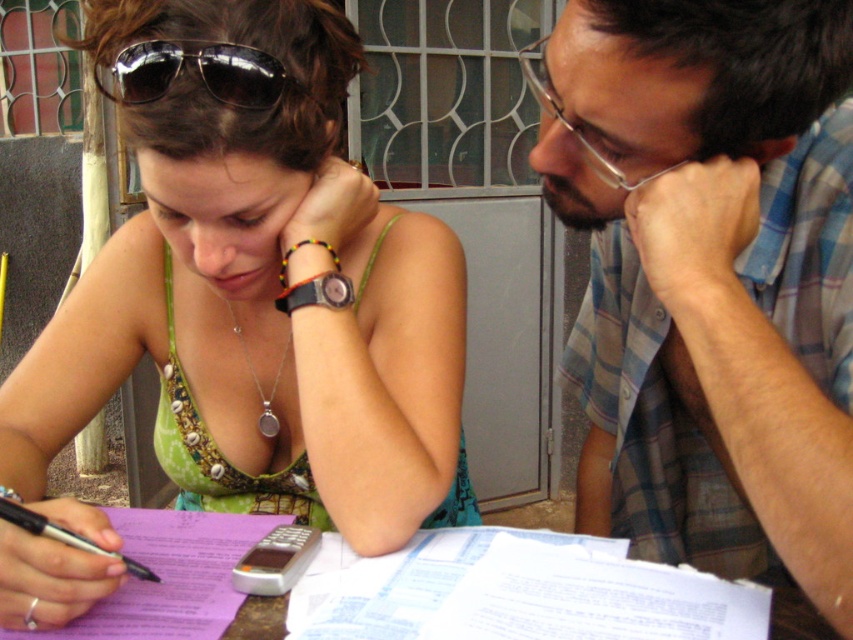
You are standing in front of the image and want to know how far the point at coordinates (614, 634) is from your current position. Can you determine the distance?

The point at coordinates (614, 634) is 22.42 inches away from the camera, so it is approximately 22.42 inches away from your current position.

You are a photographer standing 10 feet away from the two people at the table. You want to take a photo that captures both individuals clearly. Given that your camera has a maximum focus range of 10 feet, will you be able to capture both the woman and the blue plaid shirt at right in focus?

Yes, because both the woman and the blue plaid shirt at right are within the 10 feet focus range of the camera.

You are organizing a fashion show and need to arrange the green fabric dress at center and the purple paper at center on a runway. According to the image, which item should be placed to the left of the other?

The green fabric dress at center should be placed to the left of the purple paper at center because the green fabric dress at center is positioned on the left side of purple paper at center in the image.